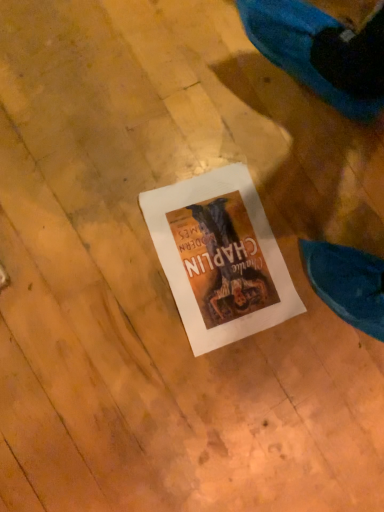
I want to click on vacant space underneath white paper poster at center (from a real-world perspective), so click(x=230, y=251).